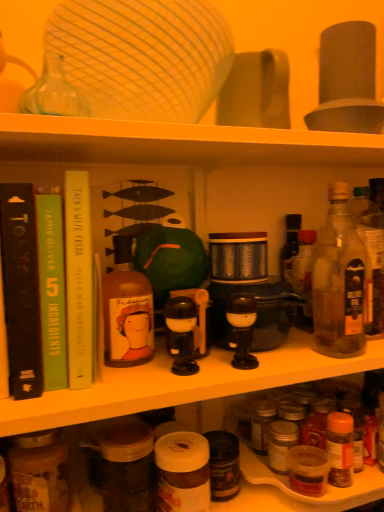
This screenshot has width=384, height=512. What are the coordinates of `free spot in front of matte black coffee machine at center` in the screenshot? It's located at (243, 374).